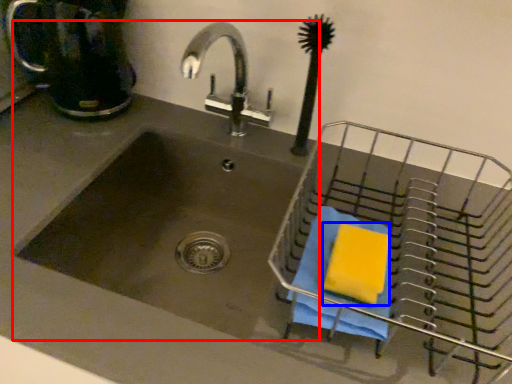
Question: Which of the following is the farthest to the observer, sink (highlighted by a red box) or soap (highlighted by a blue box)?

Choices:
 (A) sink
 (B) soap

Answer: (A)